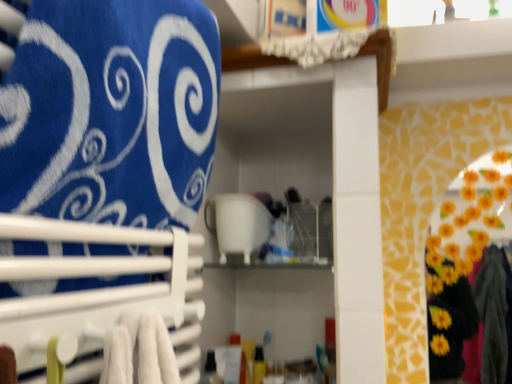
Question: Is white plastic towel rack at left at the right side of white glossy cup at center?

Choices:
 (A) no
 (B) yes

Answer: (A)

Question: Would you say white plastic towel rack at left contains white glossy cup at center?

Choices:
 (A) no
 (B) yes

Answer: (A)

Question: Does white plastic towel rack at left have a larger size compared to white glossy cup at center?

Choices:
 (A) no
 (B) yes

Answer: (A)

Question: Is white plastic towel rack at left at the left side of white glossy cup at center?

Choices:
 (A) yes
 (B) no

Answer: (A)

Question: Is white plastic towel rack at left turned away from white glossy cup at center?

Choices:
 (A) no
 (B) yes

Answer: (A)

Question: Is white plastic towel rack at left positioned in front of white glossy cup at center?

Choices:
 (A) no
 (B) yes

Answer: (B)

Question: From a real-world perspective, is blue fabric towel at upper left located beneath white glossy cup at center?

Choices:
 (A) yes
 (B) no

Answer: (B)

Question: From the image's perspective, does blue fabric towel at upper left appear higher than white glossy cup at center?

Choices:
 (A) yes
 (B) no

Answer: (A)

Question: Does blue fabric towel at upper left come in front of white glossy cup at center?

Choices:
 (A) yes
 (B) no

Answer: (A)

Question: Does blue fabric towel at upper left have a larger size compared to white glossy cup at center?

Choices:
 (A) no
 (B) yes

Answer: (B)

Question: Can white glossy cup at center be found inside blue fabric towel at upper left?

Choices:
 (A) yes
 (B) no

Answer: (B)

Question: From a real-world perspective, does blue fabric towel at upper left stand above white glossy cup at center?

Choices:
 (A) yes
 (B) no

Answer: (A)

Question: Is blue fabric towel at upper left not close to white plastic towel rack at left?

Choices:
 (A) yes
 (B) no

Answer: (B)